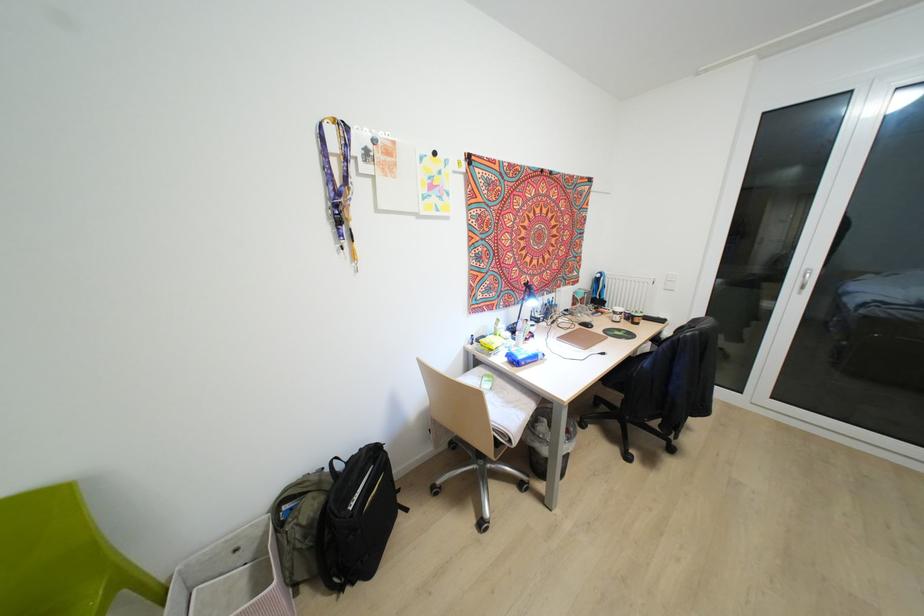
Image resolution: width=924 pixels, height=616 pixels. In order to click on black trash can in this screenshot , I will do `click(545, 440)`.